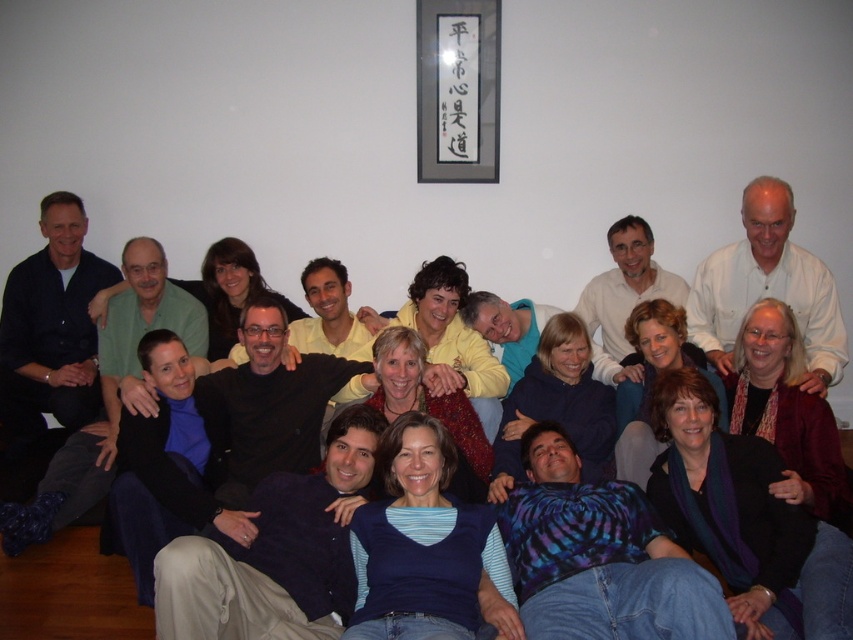
Who is taller, matte black jacket at center or white matte shirt at upper right?

matte black jacket at center is taller.

Between point (346, 312) and point (711, 344), which one is positioned behind?

The point (346, 312) is more distant.

Find the location of a particular element. This screenshot has height=640, width=853. matte black jacket at center is located at coordinates (766, 220).

Who is shorter, dark blue shirt at left or white matte shirt at upper right?

white matte shirt at upper right is shorter.

What do you see at coordinates (51, 324) in the screenshot? I see `dark blue shirt at left` at bounding box center [51, 324].

You are a GUI agent. You are given a task and a screenshot of the screen. Output one action in this format:
    pyautogui.click(x=<x>, y=<y>)
    Task: Click on the dark blue shirt at left
    
    Given the screenshot: What is the action you would take?
    pyautogui.click(x=51, y=324)

Can you confirm if matte black jacket at center is positioned above dark blue shirt at left?

Actually, matte black jacket at center is below dark blue shirt at left.

Looking at this image, does matte black jacket at center have a greater width compared to dark blue shirt at left?

Correct, the width of matte black jacket at center exceeds that of dark blue shirt at left.

Which is behind, point (126, 380) or point (77, 408)?

Positioned behind is point (77, 408).

I want to click on matte black jacket at center, so click(766, 220).